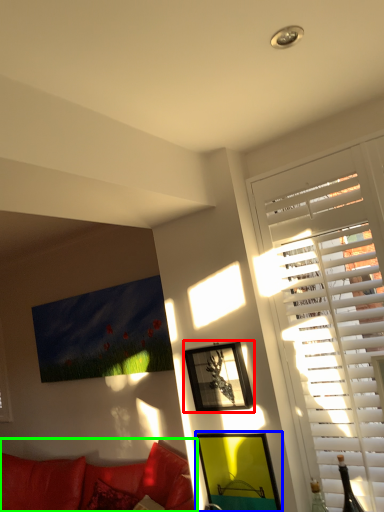
Question: Considering the real-world distances, which object is farthest from picture frame (highlighted by a red box)? picture frame (highlighted by a blue box) or studio couch (highlighted by a green box)?

Choices:
 (A) picture frame
 (B) studio couch

Answer: (B)